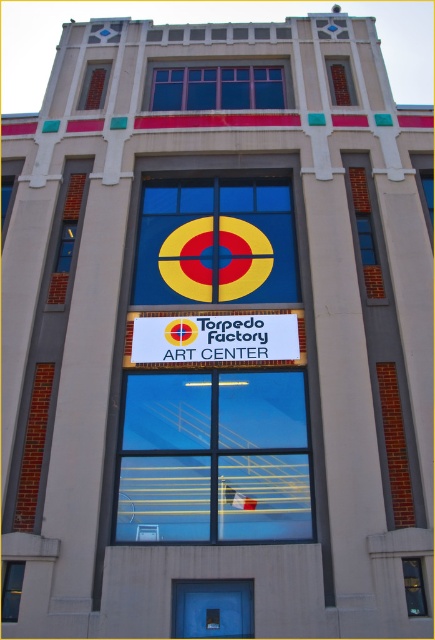
Is point (331, 61) closer to viewer compared to point (19, 570)?

No, it is behind (19, 570).

Can you confirm if clear glass window at upper center is taller than transparent glass window at lower left?

Yes, clear glass window at upper center is taller than transparent glass window at lower left.

Which is in front, point (325, 58) or point (6, 586)?

Point (6, 586)

You are a GUI agent. You are given a task and a screenshot of the screen. Output one action in this format:
    pyautogui.click(x=<x>, y=<y>)
    Task: Click on the clear glass window at upper center
    
    Given the screenshot: What is the action you would take?
    pyautogui.click(x=341, y=81)

Can you confirm if white plastic sign at center is taller than transparent glass window at lower center?

Yes, white plastic sign at center is taller than transparent glass window at lower center.

Find the location of a particular element. white plastic sign at center is located at coordinates (214, 339).

Who is more distant from viewer, (257, 355) or (180, 620)?

The point (257, 355) is behind.

At what (x,y) coordinates should I click in order to perform the action: click on white plastic sign at center. Please return your answer as a coordinate pair (x, y). Image resolution: width=435 pixels, height=640 pixels. Looking at the image, I should click on (214, 339).

How much distance is there between white plastic sign at center and transparent glass window at lower right?

The distance of white plastic sign at center from transparent glass window at lower right is 5.26 meters.

Does white plastic sign at center appear on the left side of transparent glass window at lower right?

Yes, white plastic sign at center is to the left of transparent glass window at lower right.

I want to click on white plastic sign at center, so click(214, 339).